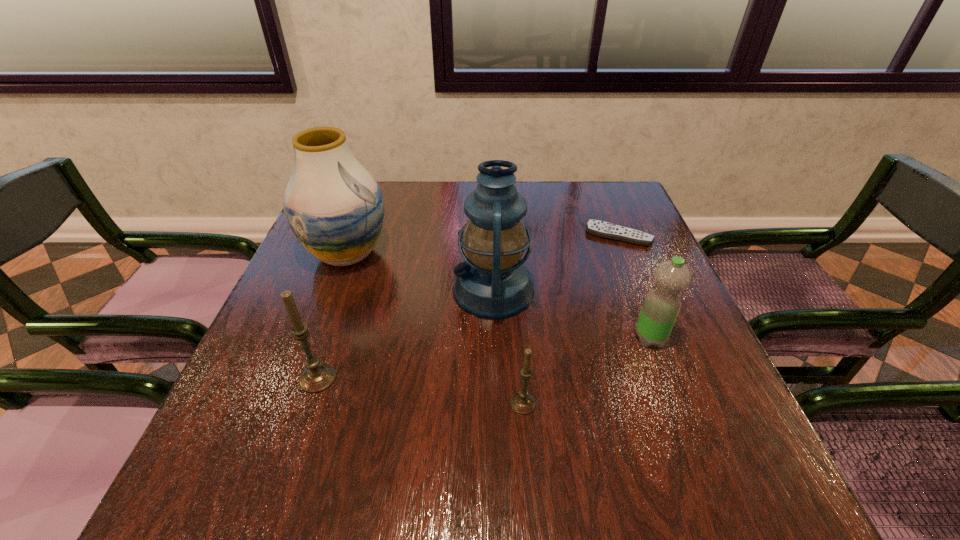
The width and height of the screenshot is (960, 540). Identify the location of water bottle located in the right edge section of the desktop. pyautogui.click(x=660, y=309).

At what (x,y) coordinates should I click in order to perform the action: click on object positioned at the far right corner. Please return your answer as a coordinate pair (x, y). This screenshot has height=540, width=960. Looking at the image, I should click on (603, 229).

The width and height of the screenshot is (960, 540). Find the location of `free spot at the far edge of the desktop`. free spot at the far edge of the desktop is located at coordinates click(x=536, y=193).

Find the location of a particular element. The width and height of the screenshot is (960, 540). free space at the near edge of the desktop is located at coordinates (551, 400).

This screenshot has height=540, width=960. Find the location of `vacant area at the left edge`. vacant area at the left edge is located at coordinates (311, 298).

The width and height of the screenshot is (960, 540). What are the coordinates of `free space at the far left corner` in the screenshot? It's located at (384, 185).

You are a GUI agent. You are given a task and a screenshot of the screen. Output one action in this format:
    pyautogui.click(x=<x>, y=<y>)
    Task: Click on the vacant space at the near right corner of the desktop
    This screenshot has height=540, width=960.
    Given the screenshot: What is the action you would take?
    pyautogui.click(x=654, y=422)

Identify the location of free space between the taller candle and the right candle. The width and height of the screenshot is (960, 540). (420, 391).

You are a GUI agent. You are given a task and a screenshot of the screen. Output one action in this format:
    pyautogui.click(x=<x>, y=<y>)
    Task: Click on the free space that is in between the lantern and the shortest object
    Image resolution: width=960 pixels, height=540 pixels.
    Given the screenshot: What is the action you would take?
    tap(556, 263)

At what (x,y) coordinates should I click in order to perform the action: click on blank region between the water bottle and the second shortest object. Please return your answer as a coordinate pair (x, y). This screenshot has height=540, width=960. Looking at the image, I should click on (587, 371).